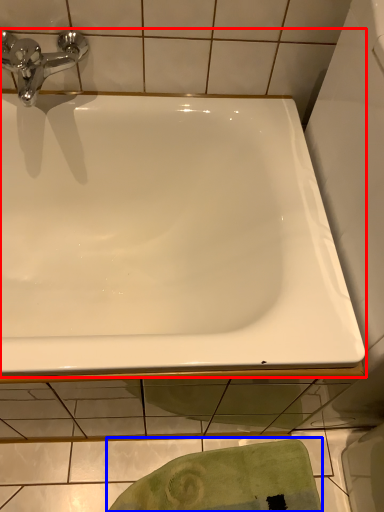
Question: Which point is further to the camera, bathtub (highlighted by a red box) or bath towel (highlighted by a blue box)?

Choices:
 (A) bathtub
 (B) bath towel

Answer: (B)